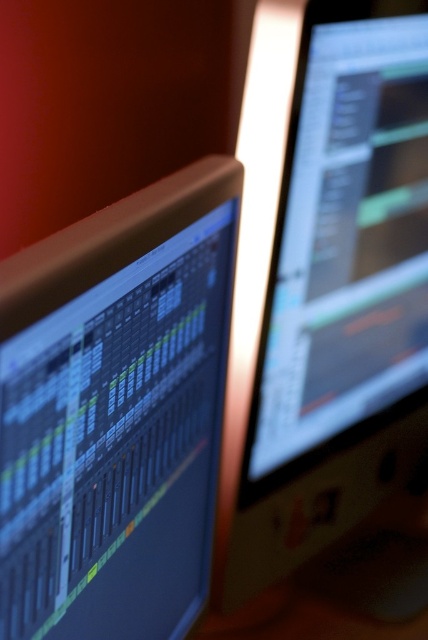
Question: Which object is closer to the camera taking this photo?

Choices:
 (A) satin black monitor at upper right
 (B) matte black monitor at left

Answer: (B)

Question: Which of the following is the farthest from the observer?

Choices:
 (A) satin black monitor at upper right
 (B) matte black monitor at left

Answer: (A)

Question: Is matte black monitor at left in front of satin black monitor at upper right?

Choices:
 (A) yes
 (B) no

Answer: (A)

Question: In this image, where is matte black monitor at left located relative to satin black monitor at upper right?

Choices:
 (A) left
 (B) right

Answer: (A)

Question: Is matte black monitor at left behind satin black monitor at upper right?

Choices:
 (A) yes
 (B) no

Answer: (B)

Question: Among these objects, which one is nearest to the camera?

Choices:
 (A) satin black monitor at upper right
 (B) matte black monitor at left

Answer: (B)